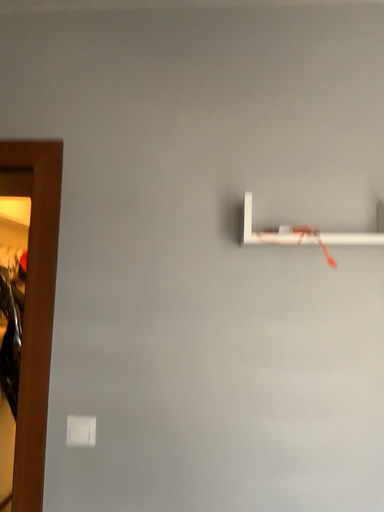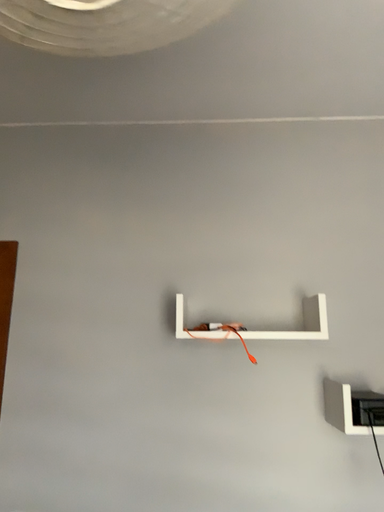
Question: Which way did the camera rotate in the video?

Choices:
 (A) rotated downward
 (B) rotated upward

Answer: (B)